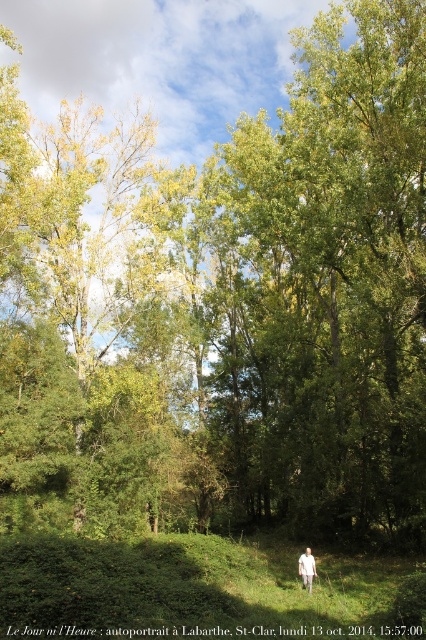
Question: Which point is closer to the camera?

Choices:
 (A) white cotton shirt at lower center
 (B) green grassy at center

Answer: (B)

Question: Among these objects, which one is nearest to the camera?

Choices:
 (A) white cotton shirt at lower center
 (B) green grassy at center

Answer: (B)

Question: Is green grassy at center to the right of white cotton shirt at lower center from the viewer's perspective?

Choices:
 (A) no
 (B) yes

Answer: (A)

Question: Can you confirm if green grassy at center is smaller than white cotton shirt at lower center?

Choices:
 (A) yes
 (B) no

Answer: (B)

Question: Can you confirm if green grassy at center is positioned below white cotton shirt at lower center?

Choices:
 (A) no
 (B) yes

Answer: (A)